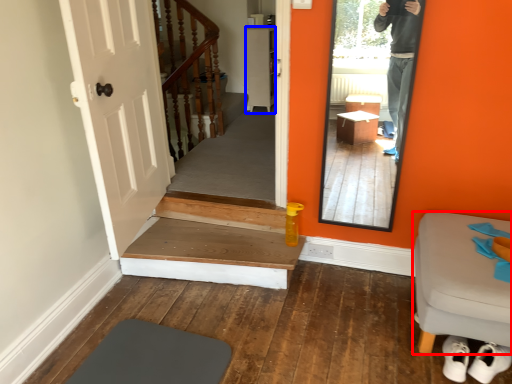
Question: Which point is further to the camera, furniture (highlighted by a red box) or cabinetry (highlighted by a blue box)?

Choices:
 (A) furniture
 (B) cabinetry

Answer: (B)